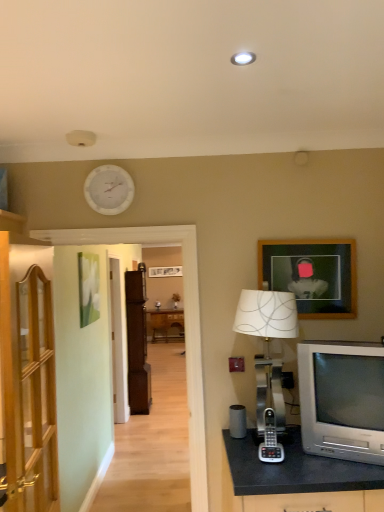
Question: In terms of width, does wooden cabinet at left, which appears as the 2th cabinetry when viewed from the back, look wider or thinner when compared to white matte clock at upper center?

Choices:
 (A) thin
 (B) wide

Answer: (B)

Question: Is wooden cabinet at left, which appears as the 2th cabinetry when viewed from the back, taller or shorter than white matte clock at upper center?

Choices:
 (A) short
 (B) tall

Answer: (B)

Question: Estimate the real-world distances between objects in this image. Which object is closer to the silver metallic phone at center?

Choices:
 (A) wooden cabinet at left, which appears as the 2th cabinetry when viewed from the back
 (B) brown wood cabinet at center, which is counted as the first cabinetry, starting from the back
 (C) silver metallic television at lower right
 (D) white matte clock at upper center
 (E) silver metallic table lamp at right

Answer: (C)

Question: Which is nearer to the silver metallic television at lower right?

Choices:
 (A) silver metallic table lamp at right
 (B) white matte clock at upper center
 (C) wooden cabinet at left, which appears as the 2th cabinetry when viewed from the back
 (D) silver metallic phone at center
 (E) brown wood cabinet at center, arranged as the second cabinetry when viewed from the front

Answer: (D)